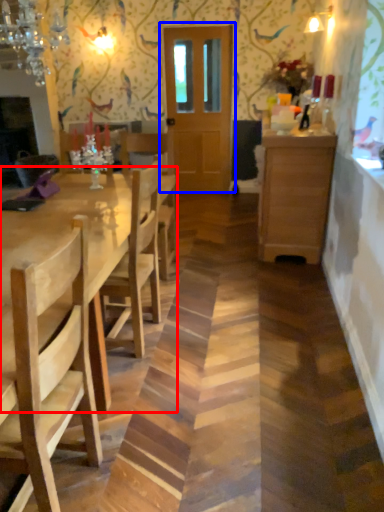
Question: Which of the following is the farthest to the observer, kitchen & dining room table (highlighted by a red box) or door (highlighted by a blue box)?

Choices:
 (A) kitchen & dining room table
 (B) door

Answer: (B)